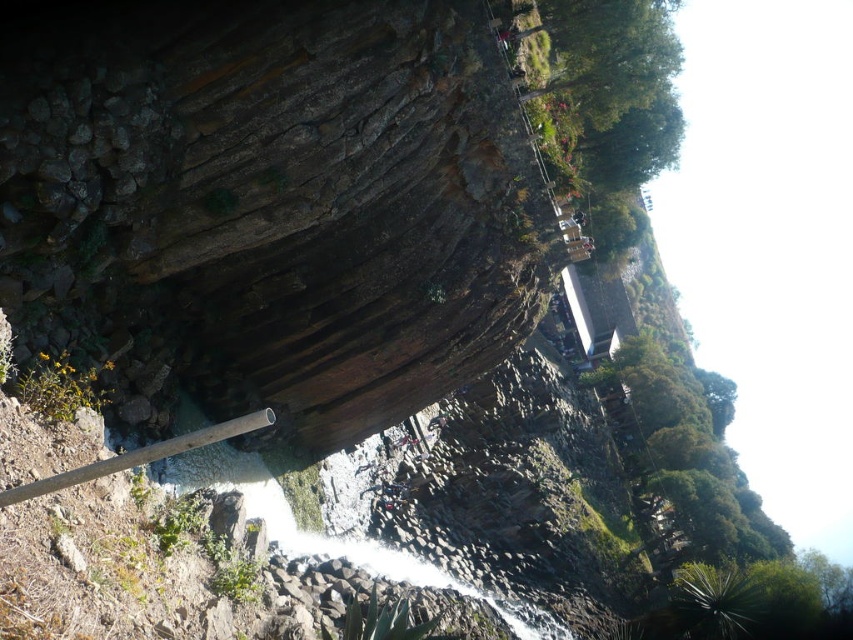
You are standing at the base of the cliff and want to reach a specific point marked at coordinates point (274, 237). If your current distance from the cliff is 200 feet, can you safely walk to that point without getting too close to the cliff edge?

The distance of point (274, 237) from camera is 183.76 feet. Since your current distance from the cliff is 200 feet, you are already 16.24 feet away from the point, so you can safely walk to that point without getting too close to the cliff edge.

You are a hiker standing at the edge of the cliff looking at the brown rough rock at center and the white frothy water at center. Which object is nearer to you?

The brown rough rock at center is closer to the viewer than the white frothy water at center.